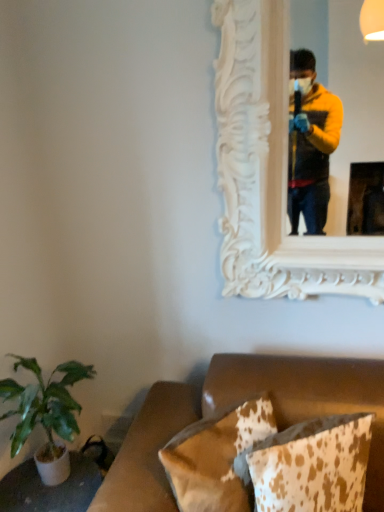
How much space does brown cowhide pillow at lower center, which ranks as the 1th pillow in left-to-right order, occupy vertically?

brown cowhide pillow at lower center, which ranks as the 1th pillow in left-to-right order, is 13.79 inches in height.

Identify the location of white carved wood mirror at upper center. (271, 170).

You are a GUI agent. You are given a task and a screenshot of the screen. Output one action in this format:
    pyautogui.click(x=<x>, y=<y>)
    Task: Click on the brown cowhide pillow at lower center, which appears as the 2th pillow when viewed from the right
    The height and width of the screenshot is (512, 384).
    Given the screenshot: What is the action you would take?
    pyautogui.click(x=217, y=458)

Between white carved wood mirror at upper center and green leafy plant at lower left, which one appears on the left side from the viewer's perspective?

green leafy plant at lower left.

Considering the relative sizes of white carved wood mirror at upper center and green leafy plant at lower left in the image provided, is white carved wood mirror at upper center thinner than green leafy plant at lower left?

Indeed, white carved wood mirror at upper center has a lesser width compared to green leafy plant at lower left.

Is white carved wood mirror at upper center situated inside green leafy plant at lower left or outside?

white carved wood mirror at upper center cannot be found inside green leafy plant at lower left.

Between white carved wood mirror at upper center and green leafy plant at lower left, which one has smaller size?

Smaller between the two is green leafy plant at lower left.

Is cowhide pillow at lower right, the first pillow when ordered from right to left, to the left or to the right of green leafy plant at lower left in the image?

cowhide pillow at lower right, the first pillow when ordered from right to left, is to the right of green leafy plant at lower left.

Can you confirm if cowhide pillow at lower right, the first pillow when ordered from right to left, is taller than green leafy plant at lower left?

Incorrect, the height of cowhide pillow at lower right, the first pillow when ordered from right to left, is not larger of that of green leafy plant at lower left.

Based on the photo, which is less distant, (311, 493) or (35, 453)?

Point (311, 493) appears to be closer to the viewer than point (35, 453).

From the image's perspective, does cowhide pillow at lower right, which ranks as the second pillow in left-to-right order, appear higher than green leafy plant at lower left?

Actually, cowhide pillow at lower right, which ranks as the second pillow in left-to-right order, appears below green leafy plant at lower left in the image.

Does green leafy plant at lower left have a greater height compared to cowhide pillow at lower right, the first pillow when ordered from right to left?

Yes.

Which object is positioned more to the left, green leafy plant at lower left or cowhide pillow at lower right, which ranks as the second pillow in left-to-right order?

Positioned to the left is green leafy plant at lower left.

Considering the positions of points (33, 421) and (329, 486), is point (33, 421) farther from camera compared to point (329, 486)?

Yes, point (33, 421) is farther from viewer.

From the image's perspective, is green leafy plant at lower left positioned above or below cowhide pillow at lower right, which ranks as the second pillow in left-to-right order?

From the image's perspective, green leafy plant at lower left appears above cowhide pillow at lower right, which ranks as the second pillow in left-to-right order.

Looking at this image, is white carved wood mirror at upper center not near cowhide pillow at lower right, which ranks as the second pillow in left-to-right order?

white carved wood mirror at upper center is near cowhide pillow at lower right, which ranks as the second pillow in left-to-right order, not far away.

Does white carved wood mirror at upper center have a greater width compared to cowhide pillow at lower right, which ranks as the second pillow in left-to-right order?

Incorrect, the width of white carved wood mirror at upper center does not surpass that of cowhide pillow at lower right, which ranks as the second pillow in left-to-right order.

Between white carved wood mirror at upper center and cowhide pillow at lower right, the first pillow when ordered from right to left, which one is positioned behind?

white carved wood mirror at upper center is further from the camera.

From a real-world perspective, relative to cowhide pillow at lower right, the first pillow when ordered from right to left, is white carved wood mirror at upper center vertically above or below?

In terms of real-world spatial position, white carved wood mirror at upper center is above cowhide pillow at lower right, the first pillow when ordered from right to left.

Does green leafy plant at lower left appear on the right side of brown cowhide pillow at lower center, which ranks as the 1th pillow in left-to-right order?

In fact, green leafy plant at lower left is to the left of brown cowhide pillow at lower center, which ranks as the 1th pillow in left-to-right order.

Between green leafy plant at lower left and brown cowhide pillow at lower center, which appears as the 2th pillow when viewed from the right, which one has more height?

green leafy plant at lower left.

From the image's perspective, is green leafy plant at lower left positioned above or below brown cowhide pillow at lower center, which appears as the 2th pillow when viewed from the right?

Clearly, from the image's perspective, green leafy plant at lower left is above brown cowhide pillow at lower center, which appears as the 2th pillow when viewed from the right.

Is green leafy plant at lower left not near brown cowhide pillow at lower center, which appears as the 2th pillow when viewed from the right?

No.

This screenshot has width=384, height=512. I want to click on pillow that is behind the cowhide pillow at lower right, which ranks as the second pillow in left-to-right order, so click(x=217, y=458).

How different are the orientations of brown cowhide pillow at lower center, which appears as the 2th pillow when viewed from the right, and cowhide pillow at lower right, the first pillow when ordered from right to left, in degrees?

The facing directions of brown cowhide pillow at lower center, which appears as the 2th pillow when viewed from the right, and cowhide pillow at lower right, the first pillow when ordered from right to left, are 7.69 degrees apart.

From a real-world perspective, which object stands above the other?

cowhide pillow at lower right, the first pillow when ordered from right to left, from a real-world perspective.

Considering the sizes of objects brown cowhide pillow at lower center, which appears as the 2th pillow when viewed from the right, and cowhide pillow at lower right, which ranks as the second pillow in left-to-right order, in the image provided, who is shorter, brown cowhide pillow at lower center, which appears as the 2th pillow when viewed from the right, or cowhide pillow at lower right, which ranks as the second pillow in left-to-right order,?

brown cowhide pillow at lower center, which appears as the 2th pillow when viewed from the right.

Which object is closer to the camera taking this photo, green leafy plant at lower left or white carved wood mirror at upper center?

green leafy plant at lower left is more forward.

Considering the positions of objects green leafy plant at lower left and white carved wood mirror at upper center in the image provided, who is more to the right, green leafy plant at lower left or white carved wood mirror at upper center?

white carved wood mirror at upper center.

Which is closer to the camera, (x=46, y=462) or (x=235, y=150)?

Clearly, point (x=46, y=462) is closer to the camera than point (x=235, y=150).

Considering the sizes of green leafy plant at lower left and white carved wood mirror at upper center in the image, is green leafy plant at lower left wider or thinner than white carved wood mirror at upper center?

Clearly, green leafy plant at lower left has more width compared to white carved wood mirror at upper center.

You are a GUI agent. You are given a task and a screenshot of the screen. Output one action in this format:
    pyautogui.click(x=<x>, y=<y>)
    Task: Click on the picture frame positioned vertically above the green leafy plant at lower left (from a real-world perspective)
    
    Given the screenshot: What is the action you would take?
    pyautogui.click(x=271, y=170)

Where is `the 1st pillow below the green leafy plant at lower left (from a real-world perspective)`? the 1st pillow below the green leafy plant at lower left (from a real-world perspective) is located at coordinates (313, 465).

Based on their spatial positions, is white carved wood mirror at upper center or green leafy plant at lower left closer to brown cowhide pillow at lower center, which appears as the 2th pillow when viewed from the right?

Among the two, green leafy plant at lower left is located nearer to brown cowhide pillow at lower center, which appears as the 2th pillow when viewed from the right.

From the image, which object appears to be farther from brown cowhide pillow at lower center, which ranks as the 1th pillow in left-to-right order, cowhide pillow at lower right, which ranks as the second pillow in left-to-right order, or white carved wood mirror at upper center?

white carved wood mirror at upper center.

Looking at the image, which one is located further to cowhide pillow at lower right, the first pillow when ordered from right to left, brown cowhide pillow at lower center, which appears as the 2th pillow when viewed from the right, or green leafy plant at lower left?

green leafy plant at lower left lies further to cowhide pillow at lower right, the first pillow when ordered from right to left, than the other object.

Estimate the real-world distances between objects in this image. Which object is closer to brown cowhide pillow at lower center, which ranks as the 1th pillow in left-to-right order, cowhide pillow at lower right, which ranks as the second pillow in left-to-right order, or green leafy plant at lower left?

Among the two, cowhide pillow at lower right, which ranks as the second pillow in left-to-right order, is located nearer to brown cowhide pillow at lower center, which ranks as the 1th pillow in left-to-right order.

Looking at the image, which one is located closer to green leafy plant at lower left, cowhide pillow at lower right, the first pillow when ordered from right to left, or brown cowhide pillow at lower center, which appears as the 2th pillow when viewed from the right?

brown cowhide pillow at lower center, which appears as the 2th pillow when viewed from the right, is closer to green leafy plant at lower left.

Based on their spatial positions, is cowhide pillow at lower right, which ranks as the second pillow in left-to-right order, or white carved wood mirror at upper center further from green leafy plant at lower left?

white carved wood mirror at upper center lies further to green leafy plant at lower left than the other object.

When comparing their distances from green leafy plant at lower left, does brown cowhide pillow at lower center, which appears as the 2th pillow when viewed from the right, or white carved wood mirror at upper center seem further?

white carved wood mirror at upper center lies further to green leafy plant at lower left than the other object.

Looking at the image, which one is located closer to white carved wood mirror at upper center, green leafy plant at lower left or brown cowhide pillow at lower center, which appears as the 2th pillow when viewed from the right?

Based on the image, brown cowhide pillow at lower center, which appears as the 2th pillow when viewed from the right, appears to be nearer to white carved wood mirror at upper center.

Where is `pillow between white carved wood mirror at upper center and brown cowhide pillow at lower center, which appears as the 2th pillow when viewed from the right, in the vertical direction`? pillow between white carved wood mirror at upper center and brown cowhide pillow at lower center, which appears as the 2th pillow when viewed from the right, in the vertical direction is located at coordinates (313, 465).

Locate an element on the screen. Image resolution: width=384 pixels, height=512 pixels. pillow between green leafy plant at lower left and cowhide pillow at lower right, which ranks as the second pillow in left-to-right order, from left to right is located at coordinates (217, 458).

You are a GUI agent. You are given a task and a screenshot of the screen. Output one action in this format:
    pyautogui.click(x=<x>, y=<y>)
    Task: Click on the houseplant between white carved wood mirror at upper center and brown cowhide pillow at lower center, which appears as the 2th pillow when viewed from the right, in the up-down direction
    Image resolution: width=384 pixels, height=512 pixels.
    Given the screenshot: What is the action you would take?
    pyautogui.click(x=46, y=413)

Locate an element on the screen. Image resolution: width=384 pixels, height=512 pixels. houseplant between white carved wood mirror at upper center and cowhide pillow at lower right, which ranks as the second pillow in left-to-right order, in the up-down direction is located at coordinates (46, 413).